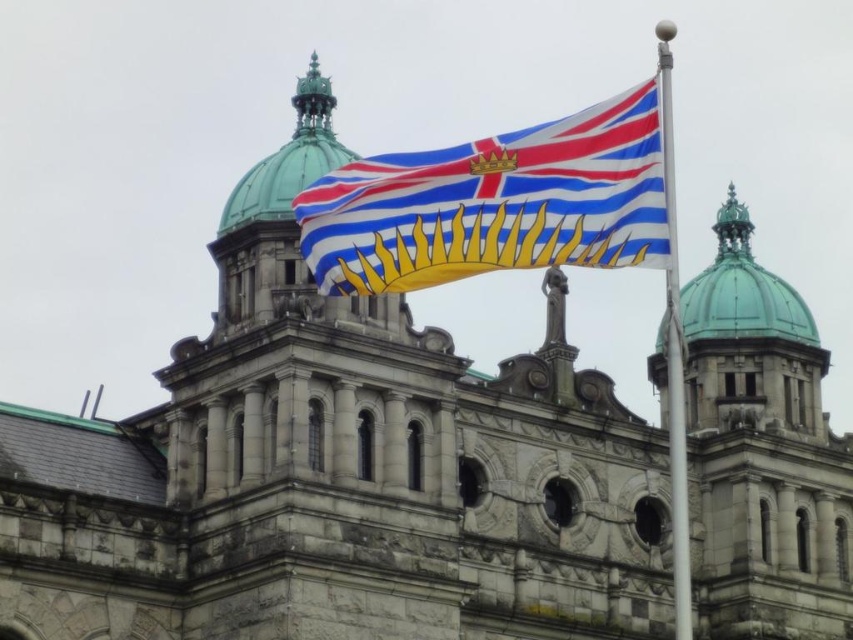
Based on the photo, which is more to the right, polyester flag at center or polished silver pole at upper right?

Positioned to the right is polished silver pole at upper right.

Measure the distance between polyester flag at center and camera.

polyester flag at center is 142.04 feet from camera.

The width and height of the screenshot is (853, 640). Find the location of `polyester flag at center`. polyester flag at center is located at coordinates (495, 204).